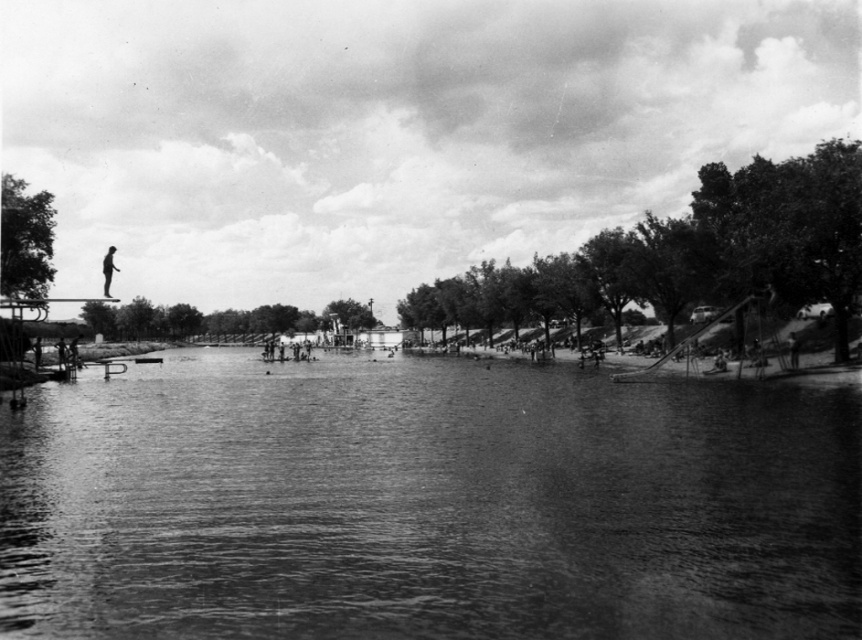
Question: Which of the following is the farthest from the observer?

Choices:
 (A) (169, 605)
 (B) (102, 292)

Answer: (B)

Question: Is smooth water at center closer to the viewer compared to silhouette figure at left?

Choices:
 (A) yes
 (B) no

Answer: (A)

Question: Which object appears farthest from the camera in this image?

Choices:
 (A) silhouette figure at left
 (B) smooth water at center

Answer: (A)

Question: Is smooth water at center closer to camera compared to silhouette figure at left?

Choices:
 (A) no
 (B) yes

Answer: (B)

Question: Does smooth water at center appear over silhouette figure at left?

Choices:
 (A) no
 (B) yes

Answer: (A)